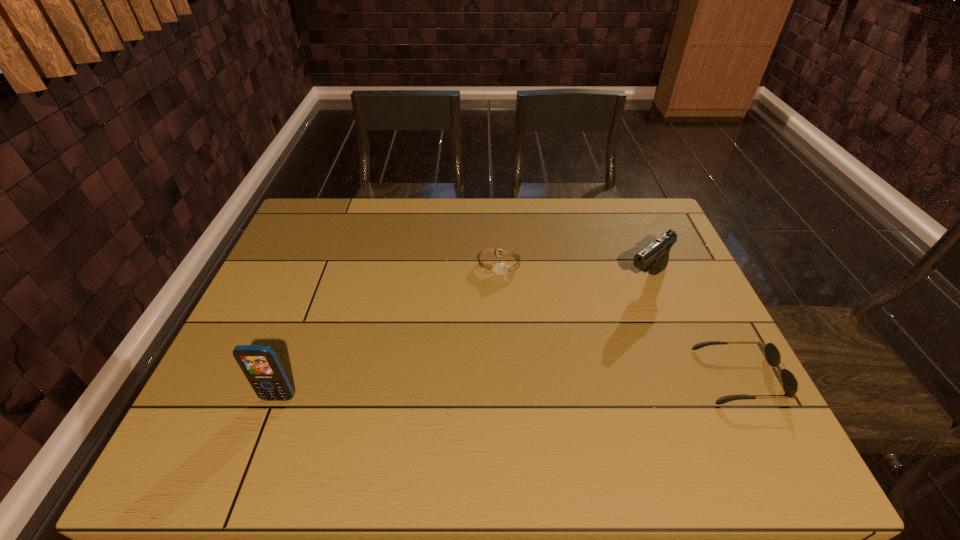
This screenshot has width=960, height=540. What are the coordinates of `vacant region between the second tallest object and the sunglasses` in the screenshot? It's located at (693, 327).

Locate an element on the screen. free space between the sunglasses and the third object from right to left is located at coordinates (619, 321).

This screenshot has height=540, width=960. What are the coordinates of `blank region between the leftmost object and the sunglasses` in the screenshot? It's located at (509, 387).

Identify which object is located as the third nearest to the second object from left to right. Please provide its 2D coordinates. Your answer should be formatted as a tuple, i.e. [(x, y)], where the tuple contains the x and y coordinates of a point satisfying the conditions above.

[(260, 364)]

Choose which object is the second nearest neighbor to the pistol. Please provide its 2D coordinates. Your answer should be formatted as a tuple, i.e. [(x, y)], where the tuple contains the x and y coordinates of a point satisfying the conditions above.

[(500, 268)]

At what (x,y) coordinates should I click in order to perform the action: click on vacant space that satisfies the following two spatial constraints: 1. on the front side of the pistol; 2. on the right side of the watch. Please return your answer as a coordinate pair (x, y). Looking at the image, I should click on (500, 278).